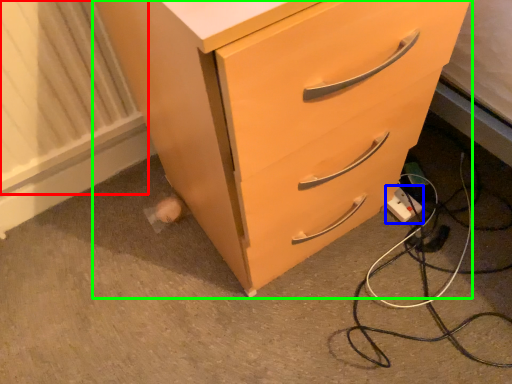
Question: Considering the real-world distances, which object is closest to radiator (highlighted by a red box)? electric outlet (highlighted by a blue box) or chest of drawers (highlighted by a green box).

Choices:
 (A) electric outlet
 (B) chest of drawers

Answer: (B)